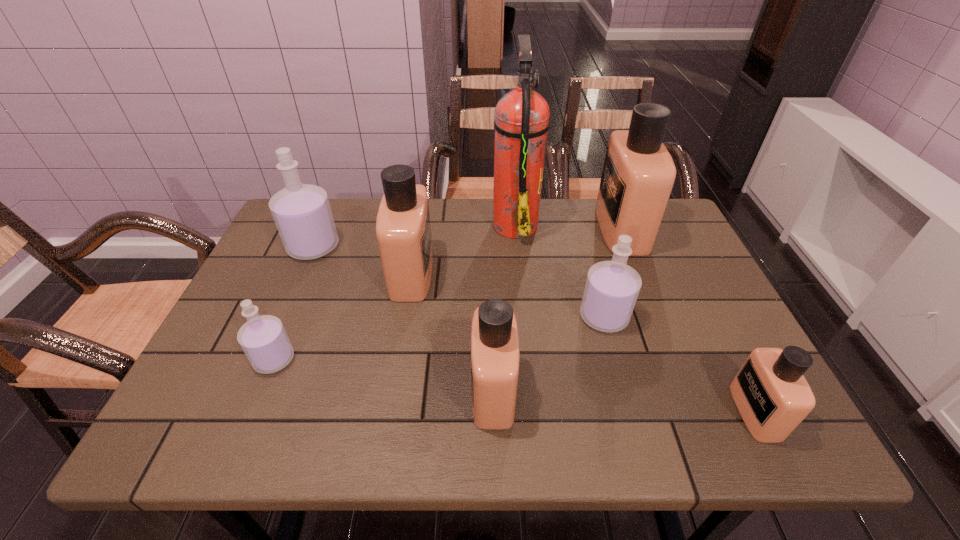
Where is `vacant space at the near right corner of the desktop`? The image size is (960, 540). vacant space at the near right corner of the desktop is located at coordinates (752, 443).

You are a GUI agent. You are given a task and a screenshot of the screen. Output one action in this format:
    pyautogui.click(x=<x>, y=<y>)
    Task: Click on the free space between the smallest purple perfume and the fourth perfume from left to right
    The image size is (960, 540).
    Given the screenshot: What is the action you would take?
    pyautogui.click(x=384, y=375)

This screenshot has width=960, height=540. In order to click on unoccupied position between the farthest purple perfume and the fourth perfume from left to right in this screenshot , I will do `click(403, 319)`.

The height and width of the screenshot is (540, 960). Identify the location of vacant area that lies between the fifth perfume from right to left and the farthest purple perfume. (363, 260).

At what (x,y) coordinates should I click in order to perform the action: click on vacant area between the farthest purple perfume and the second perfume from right to left. Please return your answer as a coordinate pair (x, y). The image size is (960, 540). Looking at the image, I should click on (468, 238).

This screenshot has height=540, width=960. Identify the location of free area in between the tallest object and the leftmost beige perfume. (464, 248).

Where is `free space between the second biggest purple perfume and the nearest purple perfume`? The width and height of the screenshot is (960, 540). free space between the second biggest purple perfume and the nearest purple perfume is located at coordinates (439, 338).

Identify the location of free spot between the seventh shortest object and the rightmost beige perfume. The image size is (960, 540). (688, 320).

The width and height of the screenshot is (960, 540). What are the coordinates of `free point between the seventh object from left to right and the fifth perfume from right to left` in the screenshot? It's located at (516, 251).

The width and height of the screenshot is (960, 540). I want to click on free space between the sixth object from right to left and the nearest purple perfume, so click(x=343, y=316).